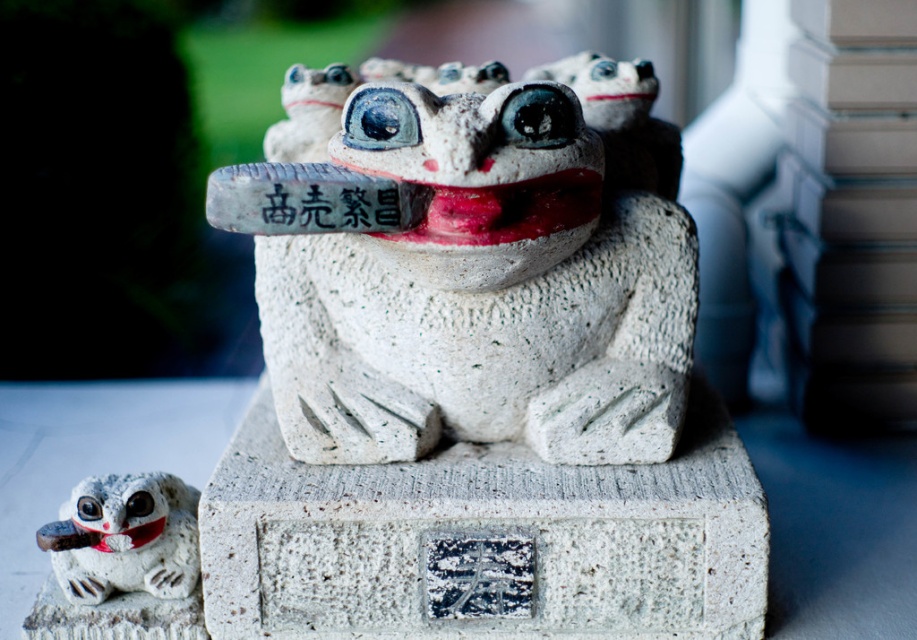
Question: Can you confirm if white stone frog at center is smaller than white stone frog at lower left?

Choices:
 (A) yes
 (B) no

Answer: (B)

Question: Is white stone frog at center to the right of white stone frog at lower left from the viewer's perspective?

Choices:
 (A) yes
 (B) no

Answer: (A)

Question: Observing the image, what is the correct spatial positioning of white stone frog at center in reference to white stone frog at lower left?

Choices:
 (A) above
 (B) below

Answer: (A)